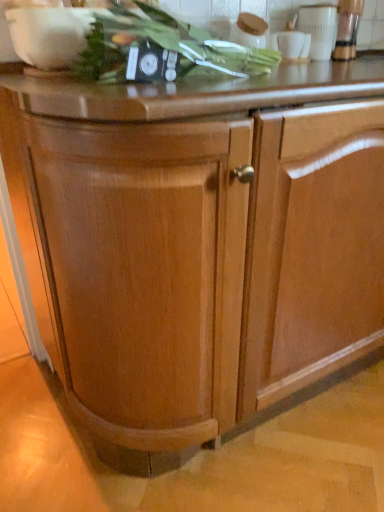
I want to click on green leafy vegetable at upper center, so click(x=161, y=49).

What do you see at coordinates (319, 29) in the screenshot? I see `white glossy cup at upper right, which is counted as the 2th appliance, starting from the right` at bounding box center [319, 29].

What are the coordinates of `metallic silver blender at upper right, arranged as the first appliance when viewed from the right` in the screenshot? It's located at (347, 28).

From the image's perspective, who appears lower, metallic silver blender at upper right, arranged as the first appliance when viewed from the right, or white glossy cup at upper right, which is the 1th appliance from left to right?

white glossy cup at upper right, which is the 1th appliance from left to right, from the image's perspective.

Is metallic silver blender at upper right, the second appliance in the left-to-right sequence, at the left side of white glossy cup at upper right, which is the 1th appliance from left to right?

No, metallic silver blender at upper right, the second appliance in the left-to-right sequence, is not to the left of white glossy cup at upper right, which is the 1th appliance from left to right.

Is white glossy cup at upper right, which is counted as the 2th appliance, starting from the right, completely or partially inside metallic silver blender at upper right, the second appliance in the left-to-right sequence?

No, metallic silver blender at upper right, the second appliance in the left-to-right sequence, does not contain white glossy cup at upper right, which is counted as the 2th appliance, starting from the right.

Does point (350, 56) come behind point (330, 35)?

Yes, point (350, 56) is behind point (330, 35).

Between white glossy cup at upper right, which is the 1th appliance from left to right, and metallic silver blender at upper right, arranged as the first appliance when viewed from the right, which one has more height?

metallic silver blender at upper right, arranged as the first appliance when viewed from the right.

Which is further, (x=329, y=16) or (x=347, y=48)?

Positioned behind is point (x=347, y=48).

Is the depth of white glossy cup at upper right, which is the 1th appliance from left to right, greater than that of metallic silver blender at upper right, the second appliance in the left-to-right sequence?

That is False.

Between white glossy cup at upper right, which is the 1th appliance from left to right, and metallic silver blender at upper right, the second appliance in the left-to-right sequence, which one appears on the left side from the viewer's perspective?

white glossy cup at upper right, which is the 1th appliance from left to right, is more to the left.

Between metallic silver blender at upper right, arranged as the first appliance when viewed from the right, and green leafy vegetable at upper center, which one has smaller width?

metallic silver blender at upper right, arranged as the first appliance when viewed from the right.

Is metallic silver blender at upper right, the second appliance in the left-to-right sequence, far from green leafy vegetable at upper center?

metallic silver blender at upper right, the second appliance in the left-to-right sequence, is actually quite close to green leafy vegetable at upper center.

What's the angular difference between metallic silver blender at upper right, the second appliance in the left-to-right sequence, and green leafy vegetable at upper center's facing directions?

The angular difference between metallic silver blender at upper right, the second appliance in the left-to-right sequence, and green leafy vegetable at upper center is 4.31 degrees.

Is metallic silver blender at upper right, arranged as the first appliance when viewed from the right, at the left side of green leafy vegetable at upper center?

No, metallic silver blender at upper right, arranged as the first appliance when viewed from the right, is not to the left of green leafy vegetable at upper center.

From the image's perspective, is white glossy cup at upper right, which is counted as the 2th appliance, starting from the right, over green leafy vegetable at upper center?

Yes, from the image's perspective, white glossy cup at upper right, which is counted as the 2th appliance, starting from the right, is on top of green leafy vegetable at upper center.

Does white glossy cup at upper right, which is counted as the 2th appliance, starting from the right, have a lesser width compared to green leafy vegetable at upper center?

Correct, the width of white glossy cup at upper right, which is counted as the 2th appliance, starting from the right, is less than that of green leafy vegetable at upper center.

Considering the relative sizes of white glossy cup at upper right, which is the 1th appliance from left to right, and green leafy vegetable at upper center in the image provided, is white glossy cup at upper right, which is the 1th appliance from left to right, taller than green leafy vegetable at upper center?

Indeed, white glossy cup at upper right, which is the 1th appliance from left to right, has a greater height compared to green leafy vegetable at upper center.

Which of these two, white glossy cup at upper right, which is counted as the 2th appliance, starting from the right, or green leafy vegetable at upper center, is smaller?

With smaller size is white glossy cup at upper right, which is counted as the 2th appliance, starting from the right.

Between green leafy vegetable at upper center and white glossy cup at upper right, which is the 1th appliance from left to right, which one has larger size?

Bigger between the two is green leafy vegetable at upper center.

Does green leafy vegetable at upper center have a greater width compared to white glossy cup at upper right, which is the 1th appliance from left to right?

Yes, green leafy vegetable at upper center is wider than white glossy cup at upper right, which is the 1th appliance from left to right.

Is green leafy vegetable at upper center further to camera compared to white glossy cup at upper right, which is counted as the 2th appliance, starting from the right?

No, green leafy vegetable at upper center is in front of white glossy cup at upper right, which is counted as the 2th appliance, starting from the right.

Is green leafy vegetable at upper center oriented towards white glossy cup at upper right, which is counted as the 2th appliance, starting from the right?

No, green leafy vegetable at upper center is not oriented towards white glossy cup at upper right, which is counted as the 2th appliance, starting from the right.

Which is behind, green leafy vegetable at upper center or metallic silver blender at upper right, arranged as the first appliance when viewed from the right?

metallic silver blender at upper right, arranged as the first appliance when viewed from the right, is behind.

Which object is wider, green leafy vegetable at upper center or metallic silver blender at upper right, the second appliance in the left-to-right sequence?

With larger width is green leafy vegetable at upper center.

Between green leafy vegetable at upper center and metallic silver blender at upper right, the second appliance in the left-to-right sequence, which one appears on the right side from the viewer's perspective?

metallic silver blender at upper right, the second appliance in the left-to-right sequence, is more to the right.

From the image's perspective, which one is positioned higher, green leafy vegetable at upper center or metallic silver blender at upper right, the second appliance in the left-to-right sequence?

From the image's view, metallic silver blender at upper right, the second appliance in the left-to-right sequence, is above.

Where is `appliance below the metallic silver blender at upper right, the second appliance in the left-to-right sequence (from a real-world perspective)`? This screenshot has width=384, height=512. appliance below the metallic silver blender at upper right, the second appliance in the left-to-right sequence (from a real-world perspective) is located at coordinates (319, 29).

Where is `appliance behind the white glossy cup at upper right, which is counted as the 2th appliance, starting from the right`? The image size is (384, 512). appliance behind the white glossy cup at upper right, which is counted as the 2th appliance, starting from the right is located at coordinates (347, 28).

When comparing their distances from metallic silver blender at upper right, arranged as the first appliance when viewed from the right, does white glossy cup at upper right, which is the 1th appliance from left to right, or green leafy vegetable at upper center seem further?

→ Among the two, green leafy vegetable at upper center is located further to metallic silver blender at upper right, arranged as the first appliance when viewed from the right.

When comparing their distances from metallic silver blender at upper right, the second appliance in the left-to-right sequence, does green leafy vegetable at upper center or white glossy cup at upper right, which is the 1th appliance from left to right, seem closer?

white glossy cup at upper right, which is the 1th appliance from left to right.

Which object lies further to the anchor point green leafy vegetable at upper center, white glossy cup at upper right, which is counted as the 2th appliance, starting from the right, or metallic silver blender at upper right, arranged as the first appliance when viewed from the right?

metallic silver blender at upper right, arranged as the first appliance when viewed from the right.

Looking at the image, which one is located closer to green leafy vegetable at upper center, metallic silver blender at upper right, arranged as the first appliance when viewed from the right, or white glossy cup at upper right, which is counted as the 2th appliance, starting from the right?

white glossy cup at upper right, which is counted as the 2th appliance, starting from the right, is positioned closer to the anchor green leafy vegetable at upper center.

Looking at the image, which one is located further to white glossy cup at upper right, which is the 1th appliance from left to right, green leafy vegetable at upper center or metallic silver blender at upper right, arranged as the first appliance when viewed from the right?

green leafy vegetable at upper center is further to white glossy cup at upper right, which is the 1th appliance from left to right.

Which object lies further to the anchor point white glossy cup at upper right, which is the 1th appliance from left to right, metallic silver blender at upper right, arranged as the first appliance when viewed from the right, or green leafy vegetable at upper center?

green leafy vegetable at upper center is positioned further to the anchor white glossy cup at upper right, which is the 1th appliance from left to right.

What are the coordinates of `appliance between green leafy vegetable at upper center and metallic silver blender at upper right, the second appliance in the left-to-right sequence, in the front-back direction` in the screenshot? It's located at (319, 29).